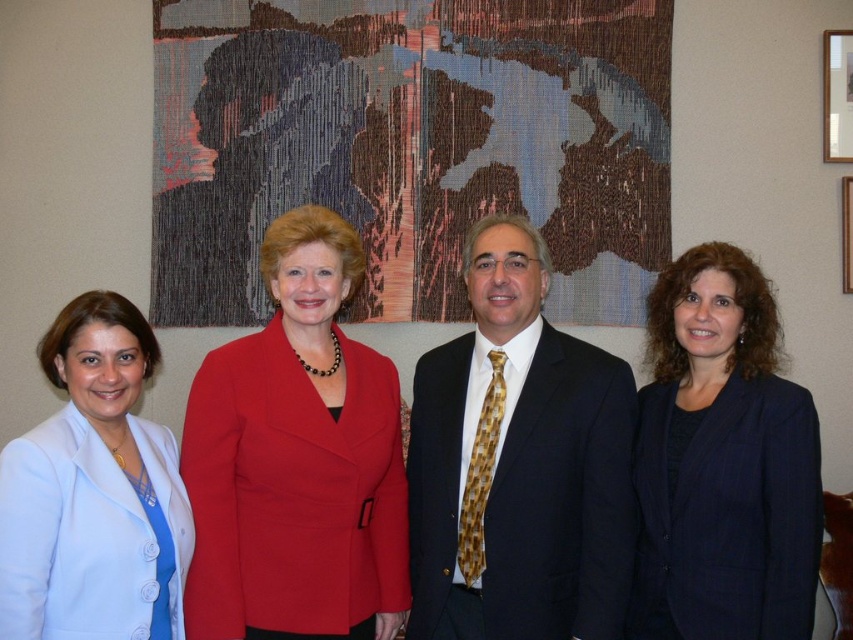
Question: Is shiny black suit at center wider than wooden frame at upper right?

Choices:
 (A) yes
 (B) no

Answer: (A)

Question: Which of the following is the closest to the observer?

Choices:
 (A) wooden frame at upper right
 (B) matte red blazer at center
 (C) shiny black suit at center

Answer: (B)

Question: Which point is farther to the camera?

Choices:
 (A) (849, 176)
 (B) (328, 438)
 (C) (556, 561)

Answer: (A)

Question: Can you confirm if dark blue suit at right is positioned below wooden frame at upper right?

Choices:
 (A) no
 (B) yes

Answer: (B)

Question: Among these objects, which one is nearest to the camera?

Choices:
 (A) light blue fabric jacket at left
 (B) wooden frame at upper right

Answer: (A)

Question: From the image, what is the correct spatial relationship of light blue fabric jacket at left in relation to wooden picture frame at upper right?

Choices:
 (A) right
 (B) left

Answer: (B)